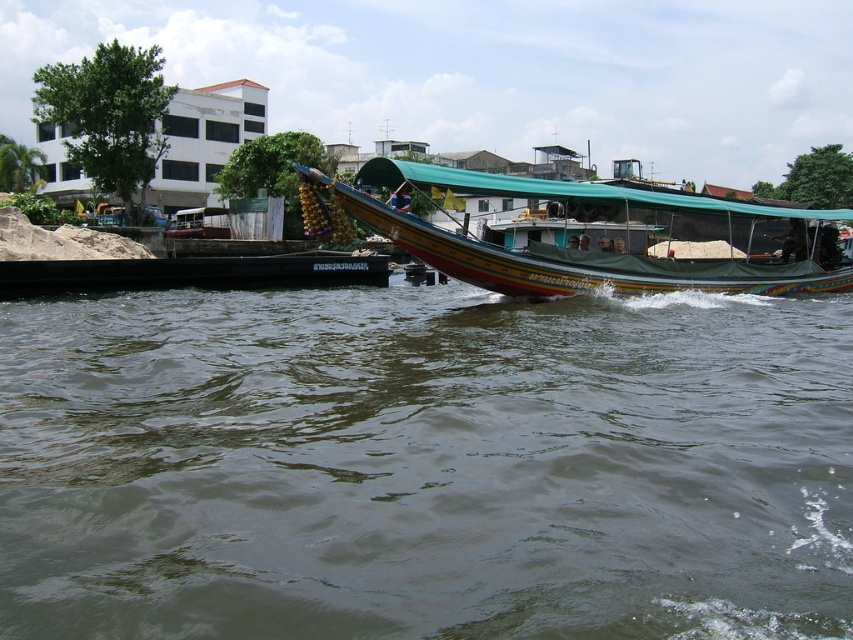
You are standing on the riverbank and want to reach a specific point marked at coordinates point [175,554]. If your maximum walking distance is 10 meters, can you reach that point without swimming?

The distance of point [175,554] from viewer is 13.42 meters, so you cannot reach that point without swimming since it is farther than your maximum walking distance of 10 meters.

You are standing on the boat and want to take a photo of two points marked in the scene. The first point is at coordinate point (392, 353) and the second point is at coordinate point (576, 262). Which point will appear larger in your photo?

Point (392, 353) will appear larger in the photo because it is closer to the camera than point (576, 262).